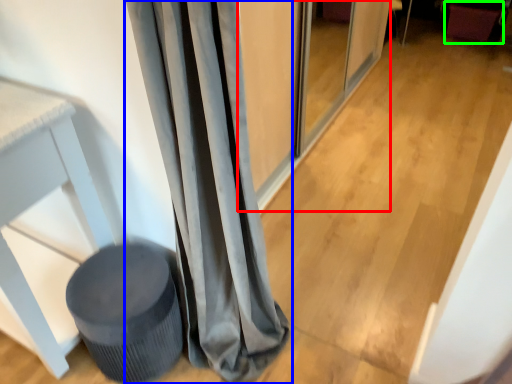
Question: Based on their relative distances, which object is farther from screen door (highlighted by a red box)? Choose from curtain (highlighted by a blue box) and swivel chair (highlighted by a green box).

Choices:
 (A) curtain
 (B) swivel chair

Answer: (B)